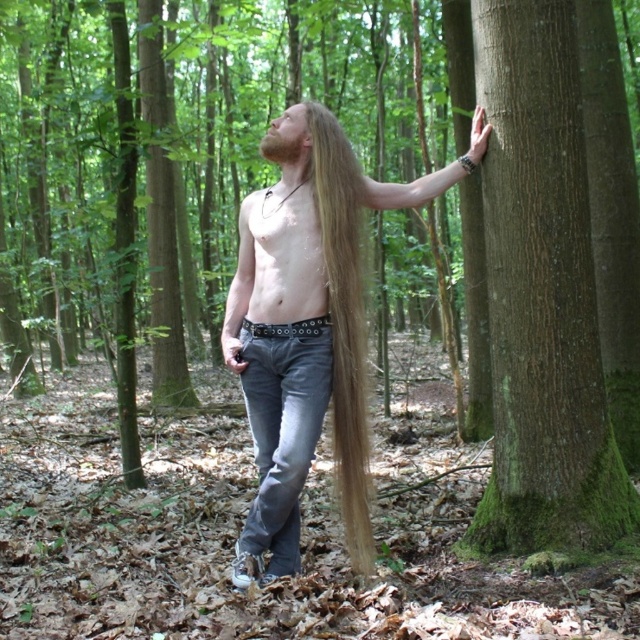
Based on the photo, who is positioned more to the left, golden smooth hair at center or matte black phone at lower center?

matte black phone at lower center is more to the left.

Is golden smooth hair at center below matte black phone at lower center?

Correct, golden smooth hair at center is located below matte black phone at lower center.

Which is behind, point (371, 552) or point (227, 344)?

The point (371, 552) is more distant.

I want to click on golden smooth hair at center, so click(x=344, y=321).

Is point (273, 147) positioned before point (472, 145)?

Yes.

Which is in front, point (272, 147) or point (468, 147)?

Positioned in front is point (272, 147).

Who is more forward, (298, 141) or (477, 157)?

Point (298, 141)

I want to click on brown fuzzy beard at upper center, so click(280, 147).

Which is in front, point (289, 458) or point (484, 145)?

Point (289, 458) is more forward.

Does denim jeans at center have a lesser height compared to leather glove at upper right?

No, denim jeans at center is not shorter than leather glove at upper right.

At what (x,y) coordinates should I click in order to perform the action: click on denim jeans at center. Please return your answer as a coordinate pair (x, y). The width and height of the screenshot is (640, 640). Looking at the image, I should click on (282, 428).

The width and height of the screenshot is (640, 640). I want to click on denim jeans at center, so click(x=282, y=428).